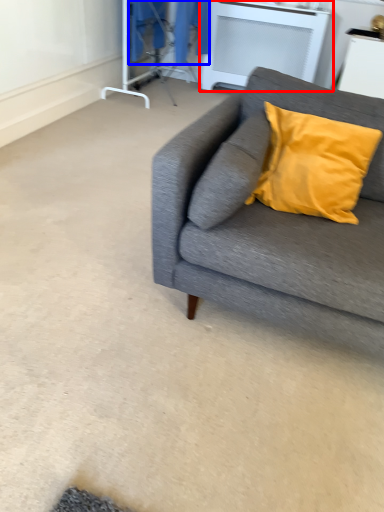
Question: Which point is further to the camera, table (highlighted by a red box) or laundry (highlighted by a blue box)?

Choices:
 (A) table
 (B) laundry

Answer: (A)